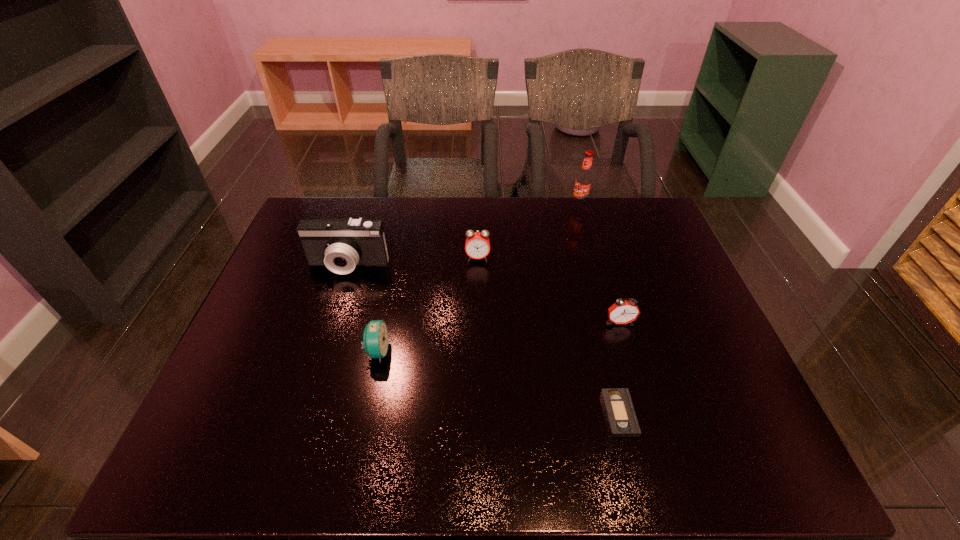
At what (x,y) coordinates should I click in order to perform the action: click on vacant space that satisfies the following two spatial constraints: 1. on the lens of the nearest object; 2. on the right side of the camcorder. Please return your answer as a coordinate pair (x, y). The height and width of the screenshot is (540, 960). Looking at the image, I should click on (301, 414).